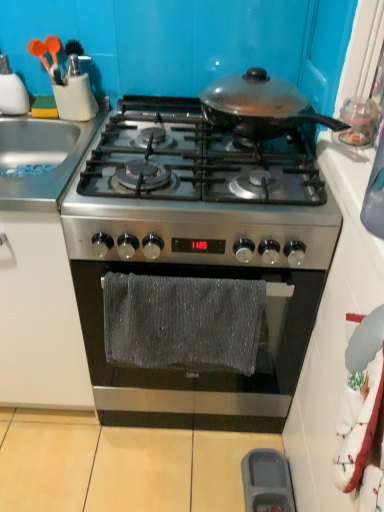
Question: Can you confirm if stainless steel sink at left is bigger than gray textured towel at center?

Choices:
 (A) no
 (B) yes

Answer: (B)

Question: Is gray textured towel at center at the back of stainless steel sink at left?

Choices:
 (A) no
 (B) yes

Answer: (A)

Question: Is stainless steel sink at left at the left side of gray textured towel at center?

Choices:
 (A) no
 (B) yes

Answer: (B)

Question: Is stainless steel sink at left at the right side of gray textured towel at center?

Choices:
 (A) no
 (B) yes

Answer: (A)

Question: From a real-world perspective, is stainless steel sink at left on gray textured towel at center?

Choices:
 (A) no
 (B) yes

Answer: (B)

Question: Considering the relative positions of stainless steel sink at left and gray textured towel at center in the image provided, is stainless steel sink at left to the left or to the right of gray textured towel at center?

Choices:
 (A) left
 (B) right

Answer: (A)

Question: Considering the positions of stainless steel sink at left and gray textured towel at center in the image, is stainless steel sink at left taller or shorter than gray textured towel at center?

Choices:
 (A) tall
 (B) short

Answer: (B)

Question: Relative to gray textured towel at center, is stainless steel sink at left in front or behind?

Choices:
 (A) behind
 (B) front

Answer: (A)

Question: Choose the correct answer: Is stainless steel sink at left inside gray textured towel at center or outside it?

Choices:
 (A) outside
 (B) inside

Answer: (A)

Question: From a real-world perspective, is stainless steel gas stove at center, positioned as the 1th gas stove in bottom-to-top order, positioned above or below stainless steel sink at left?

Choices:
 (A) below
 (B) above

Answer: (A)

Question: From the image's perspective, is stainless steel gas stove at center, positioned as the 1th gas stove in bottom-to-top order, above or below stainless steel sink at left?

Choices:
 (A) below
 (B) above

Answer: (A)

Question: Relative to stainless steel sink at left, is stainless steel gas stove at center, marked as the second gas stove in a top-to-bottom arrangement, in front or behind?

Choices:
 (A) behind
 (B) front

Answer: (B)

Question: From their relative heights in the image, would you say stainless steel gas stove at center, marked as the second gas stove in a top-to-bottom arrangement, is taller or shorter than stainless steel sink at left?

Choices:
 (A) tall
 (B) short

Answer: (A)

Question: From the image's perspective, is stainless steel sink at left located above or below stainless steel gas stove at center, which appears as the 1th gas stove when viewed from the top?

Choices:
 (A) above
 (B) below

Answer: (A)

Question: Is stainless steel sink at left taller or shorter than stainless steel gas stove at center, which appears as the 1th gas stove when viewed from the top?

Choices:
 (A) short
 (B) tall

Answer: (A)